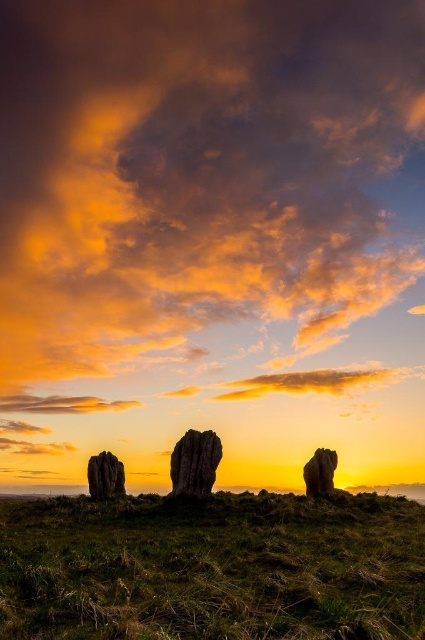
Question: Is the position of rustic stone at center less distant than that of smooth stone rock at right?

Choices:
 (A) no
 (B) yes

Answer: (B)

Question: Is rustic stone at center positioned at the back of smooth gray rock at left?

Choices:
 (A) no
 (B) yes

Answer: (A)

Question: Does smooth gray rock at left appear on the left side of smooth stone rock at right?

Choices:
 (A) yes
 (B) no

Answer: (A)

Question: Estimate the real-world distances between objects in this image. Which object is closer to the smooth stone rock at right?

Choices:
 (A) smooth gray rock at left
 (B) green grassy at lower center

Answer: (B)

Question: Among these points, which one is nearest to the camera?

Choices:
 (A) (203, 445)
 (B) (306, 476)
 (C) (311, 556)

Answer: (C)

Question: Among these points, which one is farthest from the camera?

Choices:
 (A) (334, 460)
 (B) (173, 468)
 (C) (105, 461)

Answer: (C)